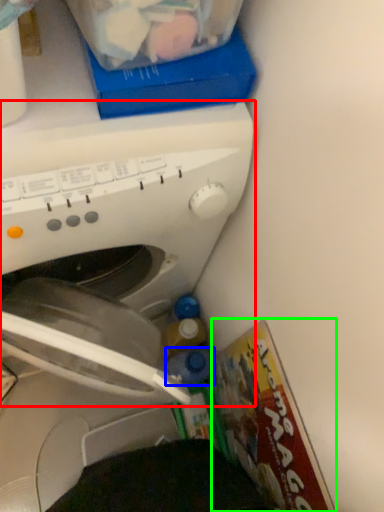
Question: Considering the real-world distances, which object is farthest from washing machine (highlighted by a red box)? bottle (highlighted by a blue box) or magazine (highlighted by a green box)?

Choices:
 (A) bottle
 (B) magazine

Answer: (A)